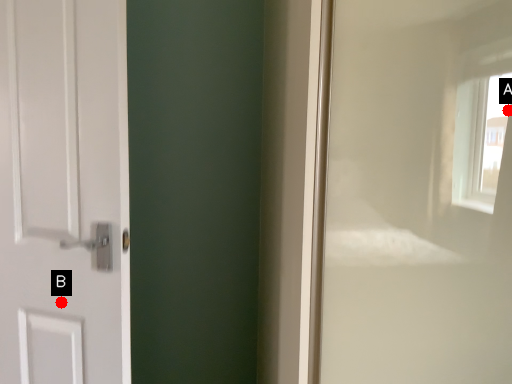
Question: Two points are circled on the image, labeled by A and B beside each circle. Which of the following is the farthest from the observer?

Choices:
 (A) A is further
 (B) B is further

Answer: (B)